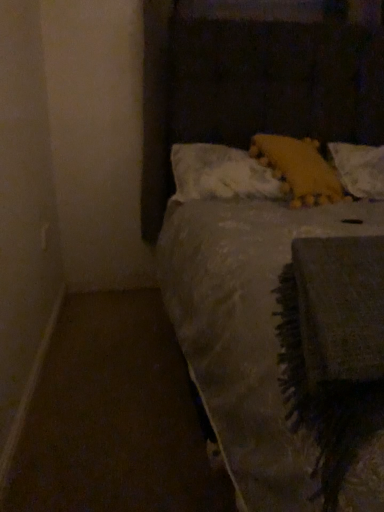
Question: Considering the positions of point click(311, 154) and point click(187, 144), is point click(311, 154) closer or farther from the camera than point click(187, 144)?

Choices:
 (A) closer
 (B) farther

Answer: (A)

Question: Considering the positions of yellow fuzzy pillow at upper right, which appears as the second pillow when viewed from the right, and white fluffy pillow at upper center, which is the first pillow in left-to-right order, in the image, is yellow fuzzy pillow at upper right, which appears as the second pillow when viewed from the right, wider or thinner than white fluffy pillow at upper center, which is the first pillow in left-to-right order,?

Choices:
 (A) thin
 (B) wide

Answer: (B)

Question: Which object is positioned closest to the yellow fabric pillow at upper right, marked as the 1th pillow in a right-to-left arrangement?

Choices:
 (A) yellow fuzzy pillow at upper right, acting as the 2th pillow starting from the left
 (B) white fluffy pillow at upper center, the third pillow in the right-to-left sequence

Answer: (A)

Question: Based on their relative distances, which object is nearer to the yellow fabric pillow at upper right, the third pillow viewed from the left?

Choices:
 (A) yellow fuzzy pillow at upper right, which appears as the second pillow when viewed from the right
 (B) white fluffy pillow at upper center, the third pillow in the right-to-left sequence

Answer: (A)